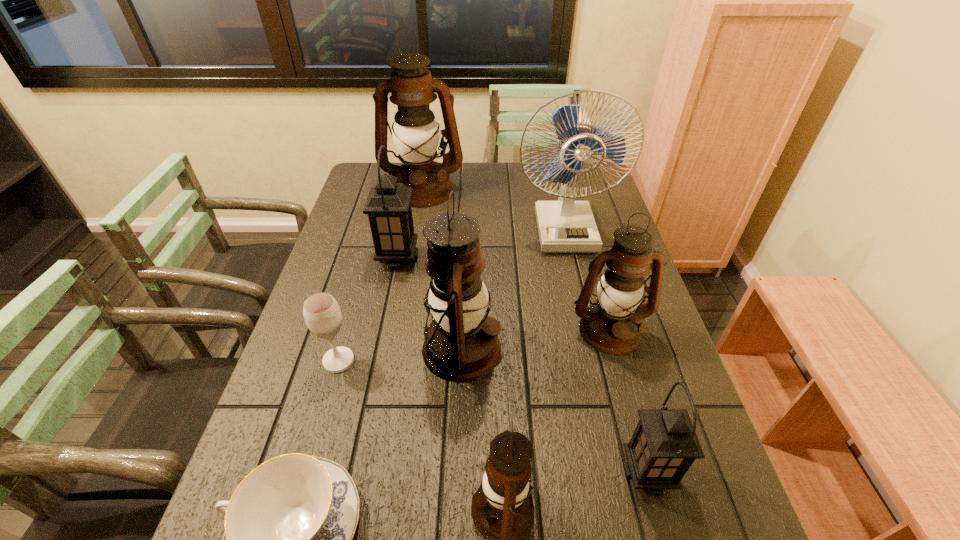
Where is `the farthest lantern`? The width and height of the screenshot is (960, 540). the farthest lantern is located at coordinates (415, 133).

Locate an element on the screen. The image size is (960, 540). the tallest lantern is located at coordinates (415, 133).

Find the location of a particular element. The image size is (960, 540). fan is located at coordinates (565, 226).

Locate an element on the screen. the second tallest lantern is located at coordinates (458, 299).

This screenshot has height=540, width=960. Identify the location of the left black lantern. (388, 205).

This screenshot has height=540, width=960. Identify the location of the farther black lantern. (388, 205).

Find the location of a particular element. The image size is (960, 540). the third biggest brown lantern is located at coordinates (611, 325).

This screenshot has height=540, width=960. Identify the location of the smaller black lantern. (664, 445).

Where is `the right black lantern`? This screenshot has width=960, height=540. the right black lantern is located at coordinates (664, 445).

You are a GUI agent. You are given a task and a screenshot of the screen. Output one action in this format:
    pyautogui.click(x=<x>, y=<y>)
    Task: Click on the second shortest object
    Image resolution: width=960 pixels, height=540 pixels.
    Given the screenshot: What is the action you would take?
    pyautogui.click(x=322, y=314)